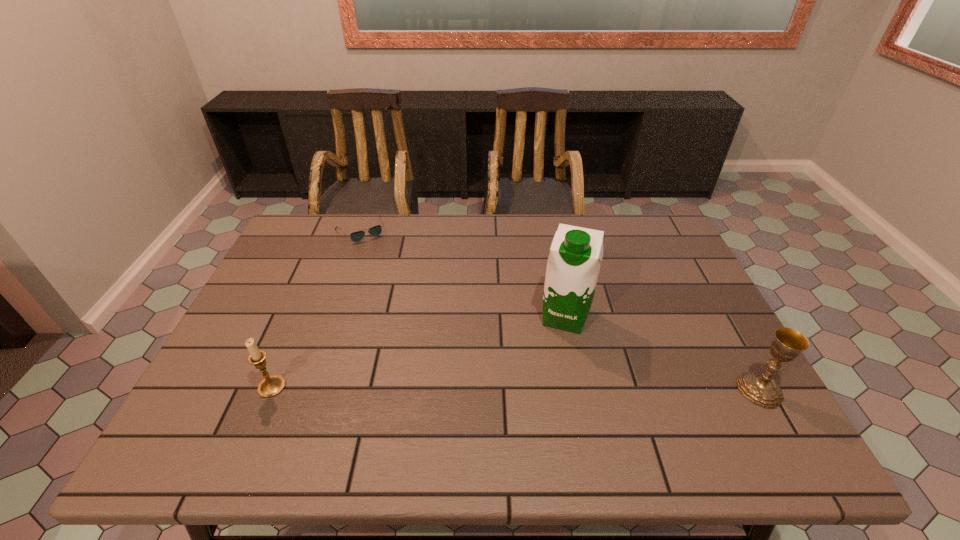
This screenshot has height=540, width=960. Identify the location of free space on the desktop that is between the candle holder and the rightmost object and is positioned on the front-facing side of the third object from left to right. (546, 388).

This screenshot has width=960, height=540. What are the coordinates of `vacant spot on the desktop that is between the candle holder and the chalice and is positioned on the lenses of the sunglasses` in the screenshot? It's located at (461, 388).